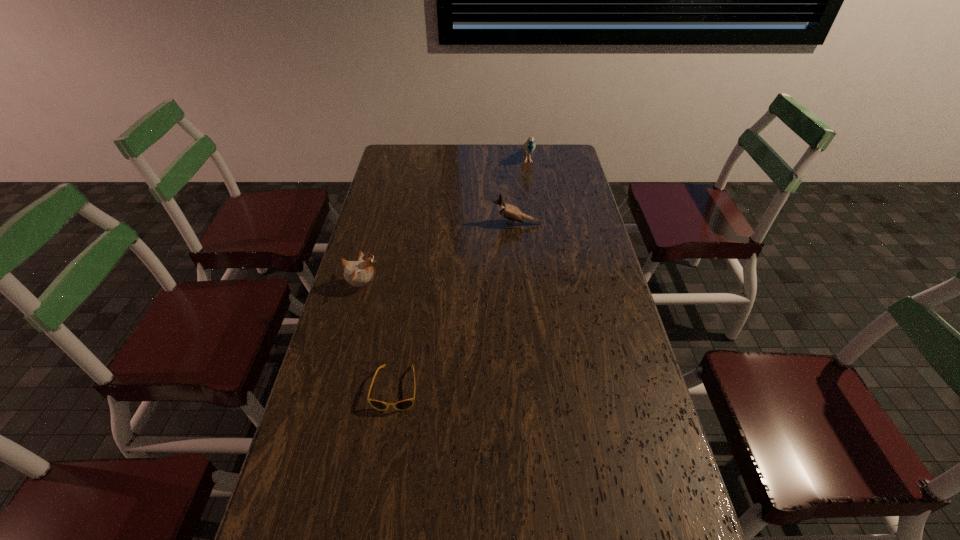
You are a GUI agent. You are given a task and a screenshot of the screen. Output one action in this format:
    pyautogui.click(x=<x>, y=<y>)
    Task: Click on the vacant space located 0.150m at the beak of the second nearest object
    This screenshot has height=540, width=960.
    Given the screenshot: What is the action you would take?
    pyautogui.click(x=427, y=286)

Locate an element on the screen. vacant point located 0.260m on the front-facing side of the sunglasses is located at coordinates (374, 524).

Where is `object at the far edge`? This screenshot has height=540, width=960. object at the far edge is located at coordinates (529, 146).

Identify the location of bird located at the left edge. This screenshot has width=960, height=540. (357, 273).

Identify the location of sunglasses present at the left edge. This screenshot has height=540, width=960. (402, 405).

I want to click on blank space at the far edge of the desktop, so click(474, 153).

Identify the location of free region at the left edge of the desktop. Image resolution: width=960 pixels, height=540 pixels. (340, 354).

This screenshot has height=540, width=960. Identify the location of vacant position at the right edge of the desktop. (585, 286).

At what (x,y) coordinates should I click in order to perform the action: click on vacant space at the far right corner. Please return your answer as a coordinate pair (x, y). The width and height of the screenshot is (960, 540). Looking at the image, I should click on (543, 161).

I want to click on free space that is in between the second object from left to right and the second nearest object, so click(379, 337).